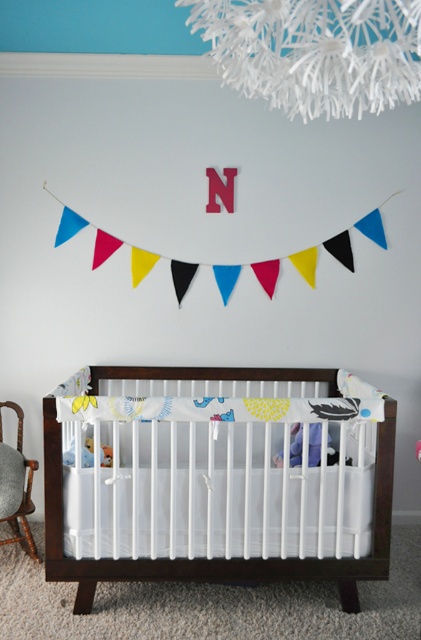
Question: Among these points, which one is nearest to the camera?

Choices:
 (A) (295, 22)
 (B) (13, 492)

Answer: (A)

Question: Is white wood crib at center bigger than wooden armchair at left?

Choices:
 (A) yes
 (B) no

Answer: (A)

Question: Which of the following is the closest to the observer?

Choices:
 (A) (333, 99)
 (B) (92, 465)

Answer: (A)

Question: Can you confirm if white paper-like at upper center is smaller than wooden armchair at left?

Choices:
 (A) no
 (B) yes

Answer: (A)

Question: Is white paper-like at upper center further to camera compared to wooden armchair at left?

Choices:
 (A) no
 (B) yes

Answer: (A)

Question: Among these points, which one is nearest to the camera?

Choices:
 (A) (239, 392)
 (B) (71, 461)
 (C) (223, 40)

Answer: (C)